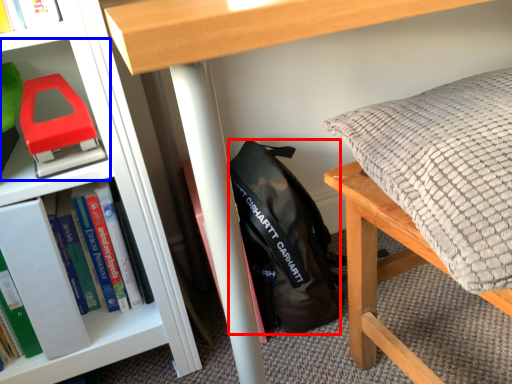
Question: Which of the following is the closest to the observer, backpack (highlighted by a red box) or shelf (highlighted by a blue box)?

Choices:
 (A) backpack
 (B) shelf

Answer: (B)